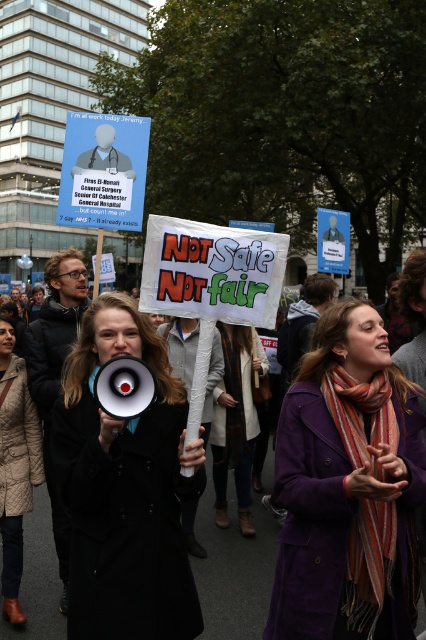
Looking at this image, can you confirm if quilted beige coat at center is positioned to the right of knitted wool scarf at center?

Incorrect, quilted beige coat at center is not on the right side of knitted wool scarf at center.

Describe the element at coordinates (16, 465) in the screenshot. The height and width of the screenshot is (640, 426). I see `quilted beige coat at center` at that location.

Identify the location of quilted beige coat at center. The image size is (426, 640). (16, 465).

Who is lower down, purple woolen coat at center or black fabric coat at center?

black fabric coat at center

Describe the element at coordinates (345, 484) in the screenshot. I see `purple woolen coat at center` at that location.

Between point (285, 568) and point (39, 545), which one is positioned behind?

The point (39, 545) is behind.

Where is `purple woolen coat at center`? purple woolen coat at center is located at coordinates (345, 484).

This screenshot has width=426, height=640. What do you see at coordinates (345, 484) in the screenshot? I see `purple woolen coat at center` at bounding box center [345, 484].

Which is below, purple woolen coat at center or quilted beige coat at center?

quilted beige coat at center is lower down.

Which is behind, point (345, 369) or point (3, 577)?

Point (3, 577)

Locate an element on the screen. Image resolution: width=426 pixels, height=640 pixels. purple woolen coat at center is located at coordinates (345, 484).